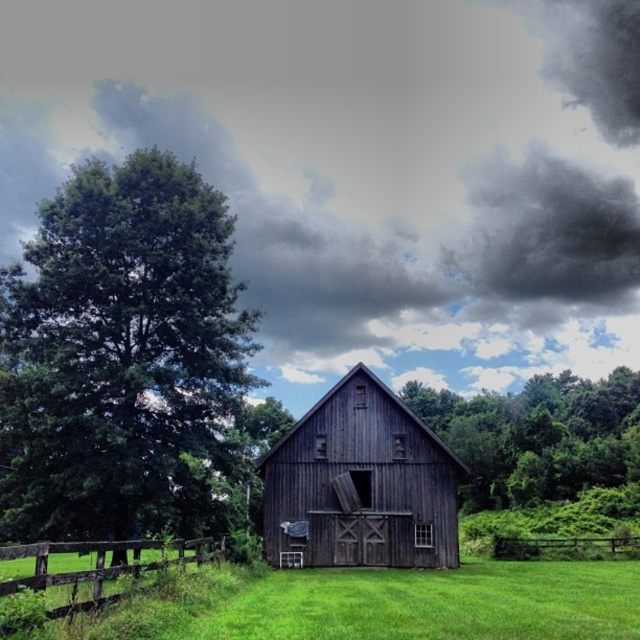
Question: Is dark gray cloud at upper center thinner than dark gray cloud at upper right?

Choices:
 (A) no
 (B) yes

Answer: (A)

Question: Which object is farther from the camera taking this photo?

Choices:
 (A) green leafy tree at left
 (B) dark wood barn at center
 (C) brown wooden fence at lower left

Answer: (B)

Question: In this image, where is green leafy tree at center located relative to brown wooden fence at lower right?

Choices:
 (A) below
 (B) above

Answer: (B)

Question: Which object appears closest to the camera in this image?

Choices:
 (A) dark wood barn at center
 (B) green leafy tree at left

Answer: (B)

Question: Considering the real-world distances, which object is closest to the green leafy tree at left?

Choices:
 (A) dark gray cloud at upper center
 (B) brown wooden fence at lower left
 (C) dark gray cloud at upper right

Answer: (B)

Question: Can you confirm if dark gray cloud at upper right is positioned to the left of brown wooden fence at lower right?

Choices:
 (A) yes
 (B) no

Answer: (B)